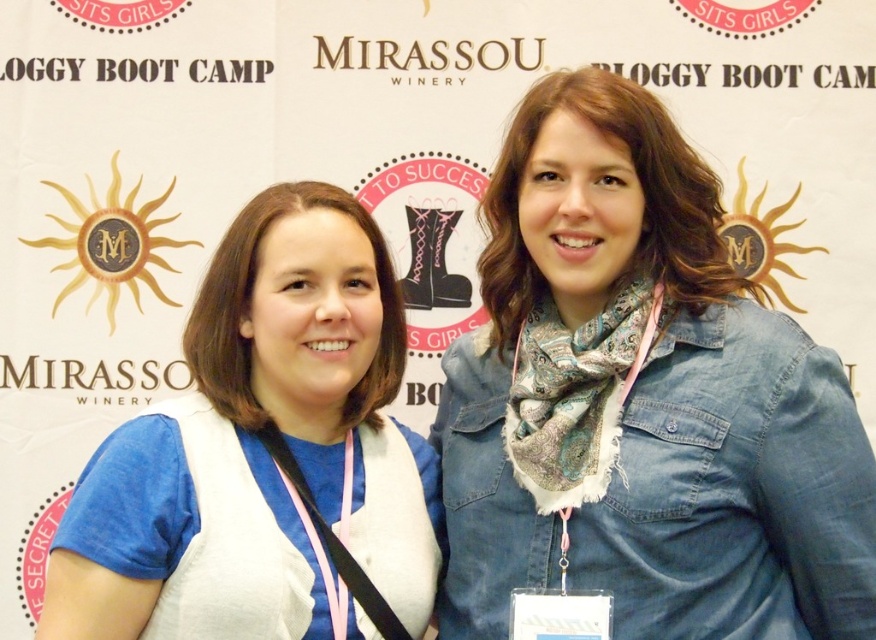
Which is more to the right, white matte vest at center or pink fabric lanyard at center?

pink fabric lanyard at center

Is point (396, 588) positioned behind point (562, 380)?

No, (396, 588) is closer to viewer.

Between point (279, 227) and point (525, 456), which one is positioned behind?

Positioned behind is point (279, 227).

Locate an element on the screen. The height and width of the screenshot is (640, 876). white matte vest at center is located at coordinates (263, 456).

Can you confirm if white matte vest at center is positioned to the left of pink fabric lanyard at left?

Correct, you'll find white matte vest at center to the left of pink fabric lanyard at left.

Can you confirm if white matte vest at center is shorter than pink fabric lanyard at left?

Incorrect, white matte vest at center's height does not fall short of pink fabric lanyard at left's.

The height and width of the screenshot is (640, 876). What do you see at coordinates (263, 456) in the screenshot? I see `white matte vest at center` at bounding box center [263, 456].

Locate an element on the screen. white matte vest at center is located at coordinates (263, 456).

Which is behind, point (856, 444) or point (556, 436)?

The point (556, 436) is more distant.

Is denim jacket at upper right smaller than pink fabric lanyard at center?

No, denim jacket at upper right is not smaller than pink fabric lanyard at center.

The height and width of the screenshot is (640, 876). What do you see at coordinates (639, 404) in the screenshot? I see `denim jacket at upper right` at bounding box center [639, 404].

The image size is (876, 640). I want to click on denim jacket at upper right, so click(639, 404).